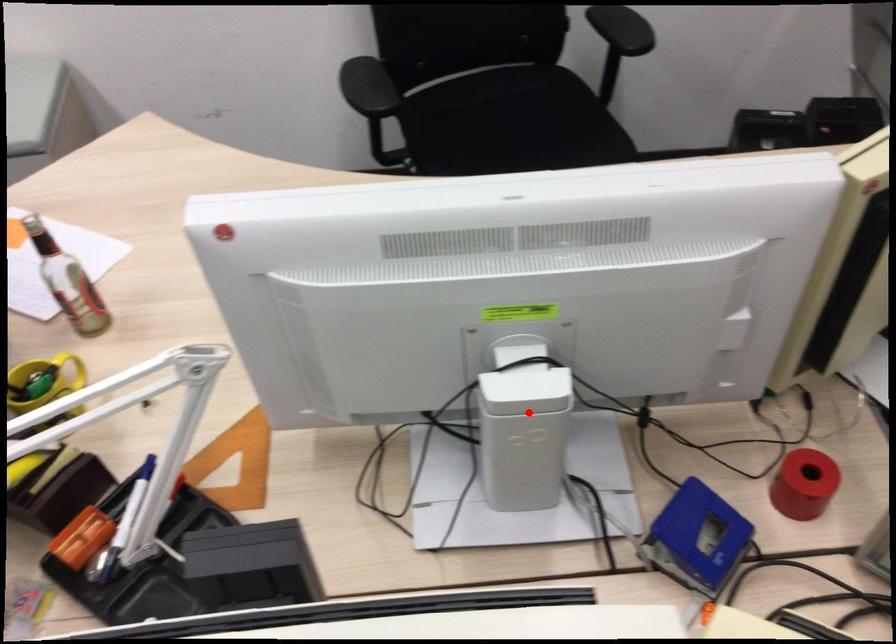
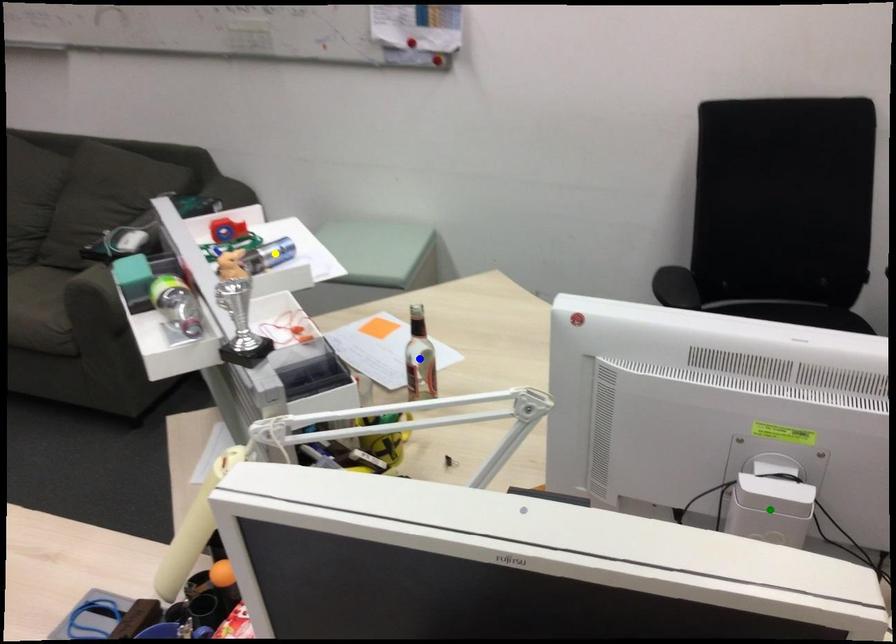
Question: I am providing you with two images of the same scene from different viewpoints. A red point is marked on the first image. You are given multiple points on the second image. Which point in image 2 is actually the same real-world point as the red point in image 1?

Choices:
 (A) yellow point
 (B) green point
 (C) blue point

Answer: (B)